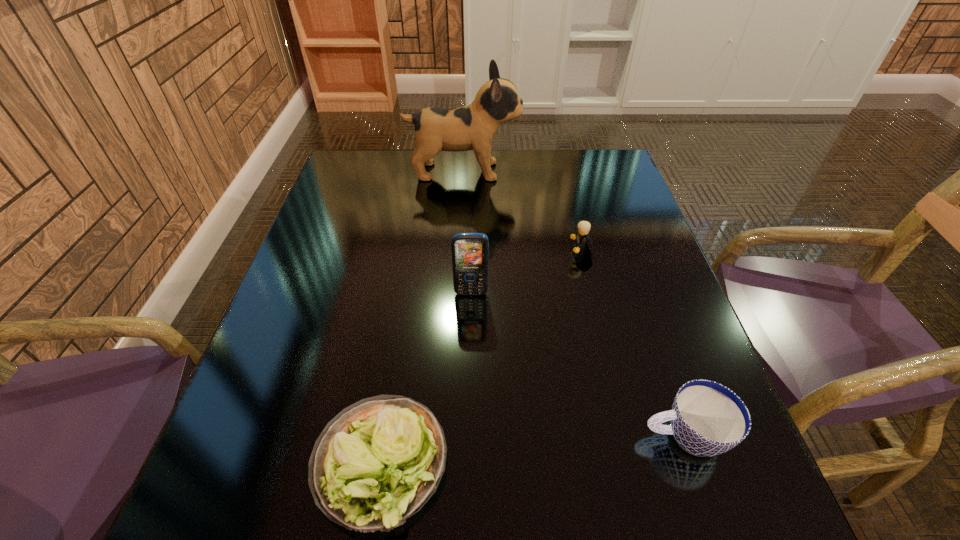
The image size is (960, 540). Identify the location of vacant space that is in between the cup and the third farthest object. (578, 364).

The height and width of the screenshot is (540, 960). In order to click on vacant space in between the puppy and the Lego in this screenshot , I will do `click(522, 211)`.

Identify the location of empty location between the Lego and the lettuce. The width and height of the screenshot is (960, 540). (481, 356).

Locate an element on the screen. vacant area that lies between the cup and the farthest object is located at coordinates (573, 303).

Where is `free spot between the fourth nearest object and the cellular telephone`? This screenshot has height=540, width=960. free spot between the fourth nearest object and the cellular telephone is located at coordinates (526, 272).

This screenshot has width=960, height=540. Identify the location of unoccupied area between the lettuce and the farthest object. (421, 316).

In order to click on the second closest object to the tallest object in this screenshot , I will do `click(470, 251)`.

At what (x,y) coordinates should I click in order to perform the action: click on object that is the fourth closest one to the tallest object. Please return your answer as a coordinate pair (x, y). Image resolution: width=960 pixels, height=540 pixels. Looking at the image, I should click on (707, 419).